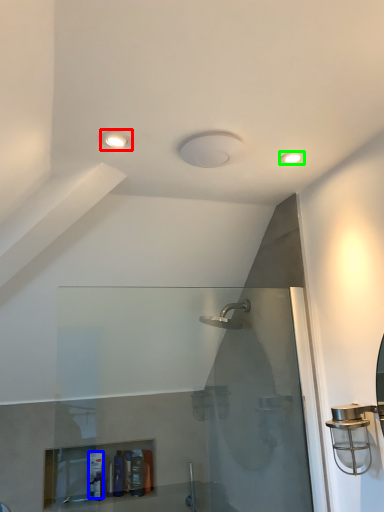
Question: Considering the real-world distances, which object is farthest from light fixture (highlighted by a red box)? toiletry (highlighted by a blue box) or light fixture (highlighted by a green box)?

Choices:
 (A) toiletry
 (B) light fixture

Answer: (A)